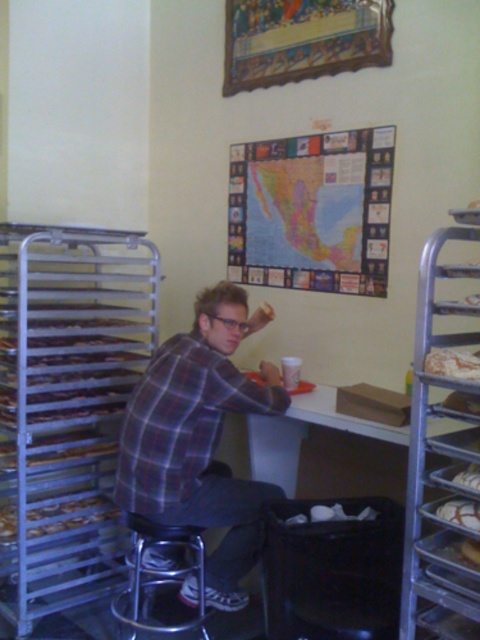
You are a photographer trying to capture the person in the plaid shirt at center and the baked golden bread at right. Since you want to emphasize both subjects equally, which one should you zoom in on more?

The plaid shirt at center is larger in size than baked golden bread at right, so you should zoom in more on the baked golden bread at right to balance their sizes in the photo.

The plaid shirt at center is represented by point (200, 436). What is the coordinate of the plaid shirt at center?

The plaid shirt at center is represented by point (200, 436).